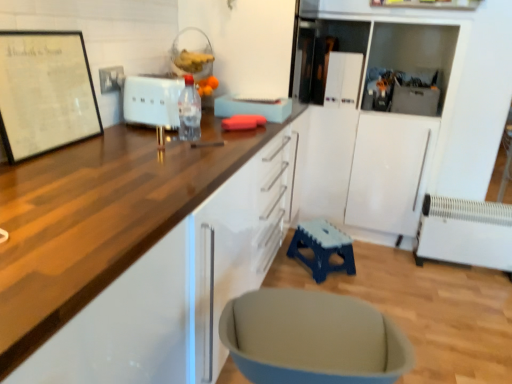
Locate an element on the screen. vacant area that lies between white plastic radiator at lower right and blue plastic stool at lower center is located at coordinates (407, 274).